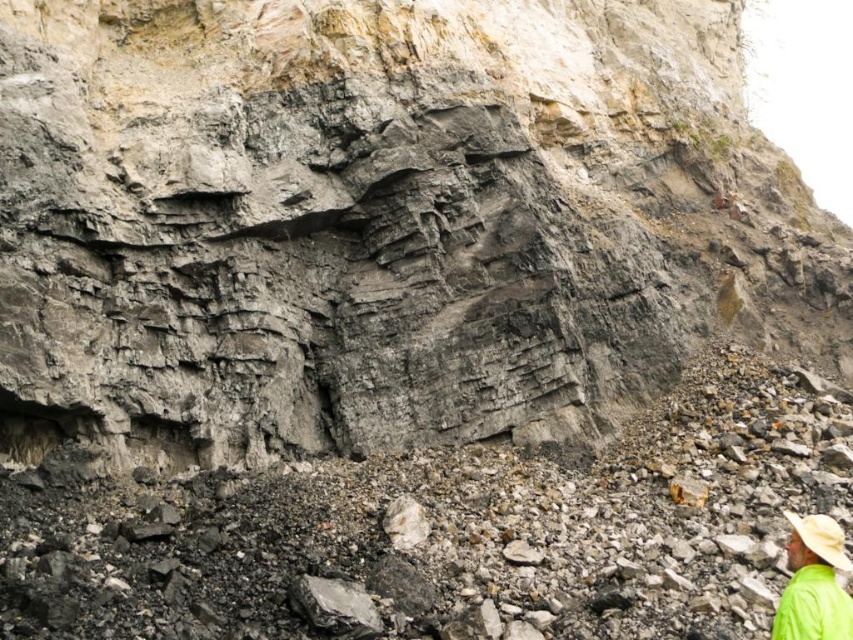
Question: Can you confirm if green fabric hat at lower right is wider than beige straw hat at lower right?

Choices:
 (A) no
 (B) yes

Answer: (B)

Question: Does green fabric hat at lower right have a smaller size compared to beige straw hat at lower right?

Choices:
 (A) yes
 (B) no

Answer: (B)

Question: Which point is farther to the camera?

Choices:
 (A) green fabric hat at lower right
 (B) beige straw hat at lower right

Answer: (B)

Question: Is green fabric hat at lower right positioned in front of beige straw hat at lower right?

Choices:
 (A) no
 (B) yes

Answer: (B)